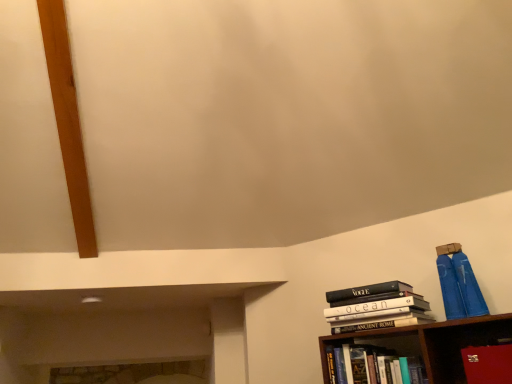
Identify the location of hardcover book at lower right, which is the 2th book in top-to-bottom order. (360, 364).

This screenshot has height=384, width=512. What do you see at coordinates (377, 308) in the screenshot?
I see `hardcover books at right, placed as the second book when sorted from bottom to top` at bounding box center [377, 308].

Identify the location of red leather book at lower right. This screenshot has height=384, width=512. (488, 364).

Considering the relative sizes of hardcover books at right, placed as the second book when sorted from bottom to top, and red leather book at lower right in the image provided, is hardcover books at right, placed as the second book when sorted from bottom to top, bigger than red leather book at lower right?

Indeed, hardcover books at right, placed as the second book when sorted from bottom to top, has a larger size compared to red leather book at lower right.

Is hardcover books at right, placed as the second book when sorted from bottom to top, closer to camera compared to red leather book at lower right?

Result: That is False.

At what (x,y) coordinates should I click in order to perform the action: click on book that is the 2nd object above the red leather book at lower right (from a real-world perspective). Please return your answer as a coordinate pair (x, y). Looking at the image, I should click on (377, 308).

Is hardcover books at right, placed as the second book when sorted from bottom to top, oriented away from red leather book at lower right?

That's not correct — hardcover books at right, placed as the second book when sorted from bottom to top, is not looking away from red leather book at lower right.

Does hardcover books at right, placed as the second book when sorted from bottom to top, have a larger size compared to hardcover book at lower right, which is the first book in bottom-to-top order?

Indeed, hardcover books at right, placed as the second book when sorted from bottom to top, has a larger size compared to hardcover book at lower right, which is the first book in bottom-to-top order.

Is hardcover books at right, placed as the first book when sorted from top to bottom, wider or thinner than hardcover book at lower right, which is the 2th book in top-to-bottom order?

In the image, hardcover books at right, placed as the first book when sorted from top to bottom, appears to be wider than hardcover book at lower right, which is the 2th book in top-to-bottom order.

From a real-world perspective, who is located higher, hardcover books at right, placed as the first book when sorted from top to bottom, or hardcover book at lower right, which is the 2th book in top-to-bottom order?

From a 3D spatial view, hardcover books at right, placed as the first book when sorted from top to bottom, is above.

Is the position of hardcover books at right, placed as the second book when sorted from bottom to top, more distant than that of hardcover book at lower right, which is the 2th book in top-to-bottom order?

That is True.

How different are the orientations of red leather book at lower right and hardcover books at right, placed as the second book when sorted from bottom to top, in degrees?

They differ by 0.401 degrees in their facing directions.

Between red leather book at lower right and hardcover books at right, placed as the first book when sorted from top to bottom, which one has larger size?

hardcover books at right, placed as the first book when sorted from top to bottom.

How distant is red leather book at lower right from hardcover books at right, placed as the first book when sorted from top to bottom?

red leather book at lower right and hardcover books at right, placed as the first book when sorted from top to bottom, are 12.60 inches apart from each other.

Can you confirm if red leather book at lower right is positioned to the right of hardcover books at right, placed as the second book when sorted from bottom to top?

Indeed, red leather book at lower right is positioned on the right side of hardcover books at right, placed as the second book when sorted from bottom to top.

From a real-world perspective, relative to hardcover books at right, placed as the second book when sorted from bottom to top, is hardcover book at lower right, which is the first book in bottom-to-top order, vertically above or below?

In terms of real-world spatial position, hardcover book at lower right, which is the first book in bottom-to-top order, is below hardcover books at right, placed as the second book when sorted from bottom to top.

Does point (370, 355) come in front of point (357, 300)?

Yes.

Is hardcover book at lower right, which is the 2th book in top-to-bottom order, taller than hardcover books at right, placed as the first book when sorted from top to bottom?

No.

Is hardcover book at lower right, which is the first book in bottom-to-top order, in contact with hardcover books at right, placed as the second book when sorted from bottom to top?

No, hardcover book at lower right, which is the first book in bottom-to-top order, is not beside hardcover books at right, placed as the second book when sorted from bottom to top.

From the picture: Is red leather book at lower right not inside hardcover book at lower right, which is the first book in bottom-to-top order?

red leather book at lower right lies outside hardcover book at lower right, which is the first book in bottom-to-top order,'s area.

Can you confirm if red leather book at lower right is thinner than hardcover book at lower right, which is the first book in bottom-to-top order?

No.

Who is bigger, red leather book at lower right or hardcover book at lower right, which is the first book in bottom-to-top order?

Bigger between the two is hardcover book at lower right, which is the first book in bottom-to-top order.

Is hardcover book at lower right, which is the first book in bottom-to-top order, thinner than red leather book at lower right?

Yes, hardcover book at lower right, which is the first book in bottom-to-top order, is thinner than red leather book at lower right.

Are hardcover book at lower right, which is the first book in bottom-to-top order, and red leather book at lower right beside each other?

No, hardcover book at lower right, which is the first book in bottom-to-top order, is not touching red leather book at lower right.

Does hardcover book at lower right, which is the first book in bottom-to-top order, appear on the left side of red leather book at lower right?

Yes.

This screenshot has height=384, width=512. I want to click on paperback book beneath the hardcover books at right, placed as the second book when sorted from bottom to top (from a real-world perspective), so click(x=488, y=364).

The image size is (512, 384). Find the location of `book that is above the hardcover book at lower right, which is the first book in bottom-to-top order (from a real-world perspective)`. book that is above the hardcover book at lower right, which is the first book in bottom-to-top order (from a real-world perspective) is located at coordinates (377, 308).

Based on the photo, from the image, which object appears to be nearer to red leather book at lower right, hardcover books at right, placed as the first book when sorted from top to bottom, or hardcover book at lower right, which is the 2th book in top-to-bottom order?

hardcover books at right, placed as the first book when sorted from top to bottom, is closer to red leather book at lower right.

Looking at the image, which one is located further to hardcover book at lower right, which is the first book in bottom-to-top order, red leather book at lower right or hardcover books at right, placed as the first book when sorted from top to bottom?

red leather book at lower right lies further to hardcover book at lower right, which is the first book in bottom-to-top order, than the other object.

From the image, which object appears to be nearer to hardcover books at right, placed as the second book when sorted from bottom to top, red leather book at lower right or hardcover book at lower right, which is the first book in bottom-to-top order?

Based on the image, hardcover book at lower right, which is the first book in bottom-to-top order, appears to be nearer to hardcover books at right, placed as the second book when sorted from bottom to top.

Looking at the image, which one is located closer to hardcover books at right, placed as the first book when sorted from top to bottom, hardcover book at lower right, which is the first book in bottom-to-top order, or red leather book at lower right?

hardcover book at lower right, which is the first book in bottom-to-top order, is positioned closer to the anchor hardcover books at right, placed as the first book when sorted from top to bottom.

Looking at the image, which one is located further to red leather book at lower right, hardcover book at lower right, which is the first book in bottom-to-top order, or hardcover books at right, placed as the first book when sorted from top to bottom?

The object further to red leather book at lower right is hardcover book at lower right, which is the first book in bottom-to-top order.

Based on their spatial positions, is hardcover books at right, placed as the second book when sorted from bottom to top, or red leather book at lower right closer to hardcover book at lower right, which is the 2th book in top-to-bottom order?

Among the two, hardcover books at right, placed as the second book when sorted from bottom to top, is located nearer to hardcover book at lower right, which is the 2th book in top-to-bottom order.

The width and height of the screenshot is (512, 384). What are the coordinates of `book situated between hardcover book at lower right, which is the 2th book in top-to-bottom order, and red leather book at lower right from left to right` in the screenshot? It's located at (377, 308).